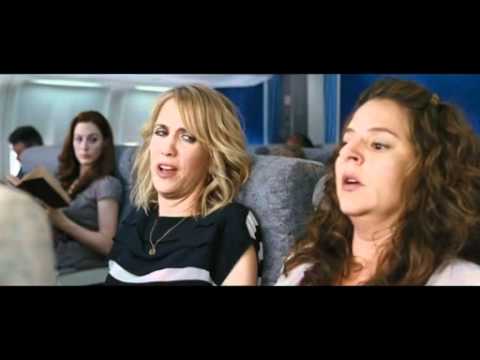
Find the location of `book`. book is located at coordinates (45, 193).